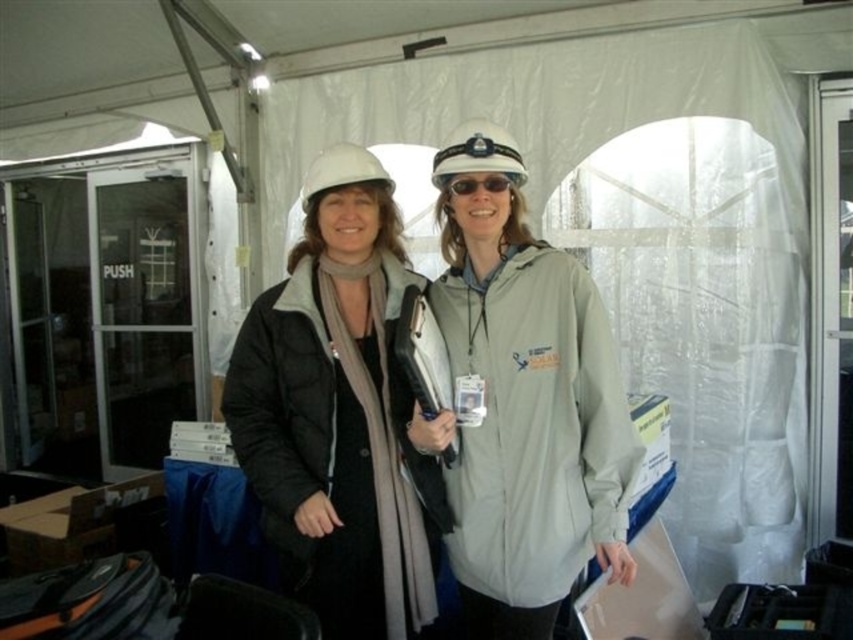
You are planning to place a rectangular box that is 1.2 meters wide on the floor between the matte black jacket at center and the white matte hard hat at center. Based on their widths, can the box fit between them without overlapping?

The matte black jacket at center might be wider than the white matte hard hat at center, so the total width required for both objects could exceed the box width of 1.2 meters. However, since the exact widths aren not provided, it is uncertain if the box will fit without overlapping.

You are a safety inspector checking the equipment of workers in a construction site. You notice two items at the center of your view, the matte white hard hat at center and the sunglassestransparent at center. Which one has a larger size?

The matte white hard hat at center is bigger than the sunglassestransparent at center, so the matte white hard hat at center has a larger size.

You are a safety inspector standing 1.6 meters tall and need to check if the matte black jacket at center is within your reach to inspect its safety label. Can you reach it?

The matte black jacket at center is 1.50 meters away from the viewer. Since the inspector is 1.6 meters tall, they can easily reach the jacket to inspect its safety label as the distance is within a comfortable arm length.